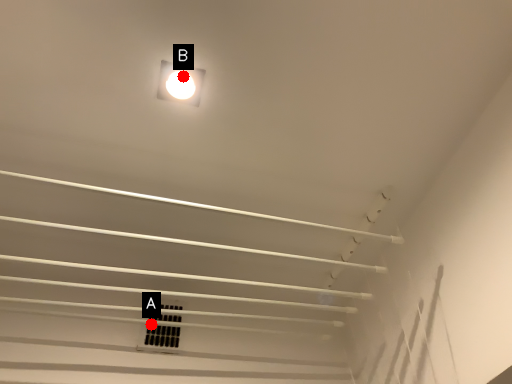
Question: Two points are circled on the image, labeled by A and B beside each circle. Which point is farther to the camera?

Choices:
 (A) A is further
 (B) B is further

Answer: (A)